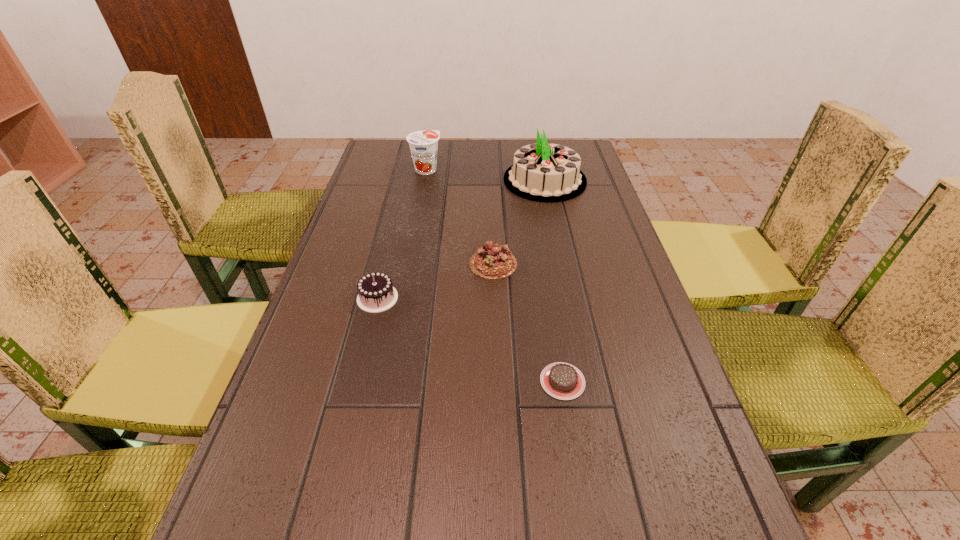
You are a GUI agent. You are given a task and a screenshot of the screen. Output one action in this format:
    pyautogui.click(x=<x>, y=<y>)
    Task: Click on the birthday cake
    This screenshot has width=960, height=540.
    Given the screenshot: What is the action you would take?
    pyautogui.click(x=543, y=172)

Where is `yogurt`? The image size is (960, 540). yogurt is located at coordinates (423, 144).

Find the location of `the leftmost chocolate cake`. the leftmost chocolate cake is located at coordinates (376, 293).

At what (x,y) coordinates should I click in order to perform the action: click on the tallest chocolate cake. Please return your answer as a coordinate pair (x, y). The height and width of the screenshot is (540, 960). Looking at the image, I should click on (376, 293).

Find the location of a particular element. This screenshot has height=540, width=960. the fourth tallest object is located at coordinates (493, 261).

Image resolution: width=960 pixels, height=540 pixels. Find the location of `the second chocolate cake from left to right`. the second chocolate cake from left to right is located at coordinates (493, 261).

At what (x,y) coordinates should I click in order to perform the action: click on the shortest object. Please return your answer as a coordinate pair (x, y). Looking at the image, I should click on (564, 381).

Locate an element on the screen. The width and height of the screenshot is (960, 540). the nearest chocolate cake is located at coordinates (564, 381).

Where is `free location located 0.140m on the back of the birthday cake`? The width and height of the screenshot is (960, 540). free location located 0.140m on the back of the birthday cake is located at coordinates (537, 143).

The width and height of the screenshot is (960, 540). In order to click on vacant space located on the front of the yogurt in this screenshot , I will do `click(423, 186)`.